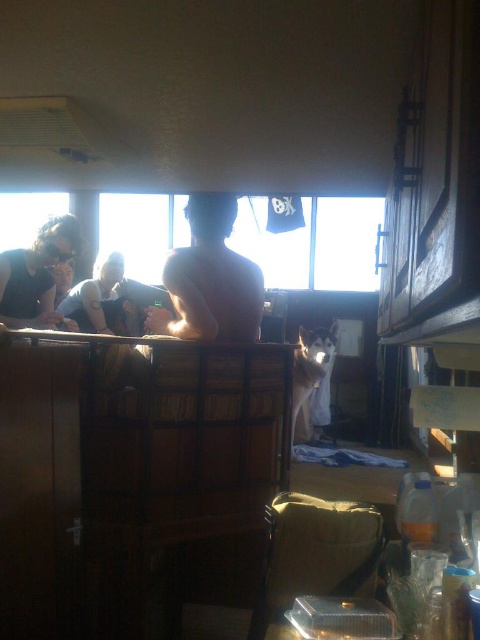
You are trying to decide whether to place a 1.2 meter wide painting on the wall where the transparent glass window at upper center is located. Given the size of the window, can the painting fit horizontally without overlapping the matte black shirt at left?

The transparent glass window at upper center is wider than the matte black shirt at left. However, the description does not provide exact measurements for the window or the shirt, so it is uncertain if the 1.2 meter painting will fit without overlapping. Additional information about their specific dimensions is needed to determine this accurately.

You are a photographer trying to capture the scene. You notice there is a point at the center of the image with coordinates point (210, 280). What is located at that point?

The point at (210, 280) is where the naked skin at center is located.